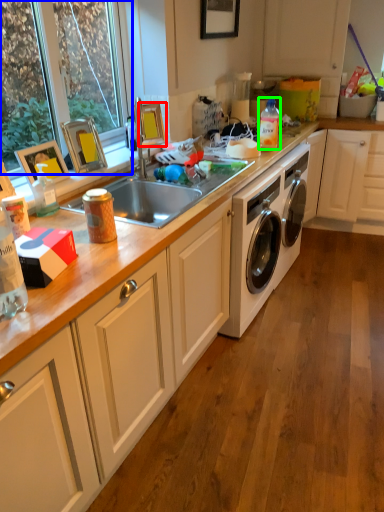
Question: Estimate the real-world distances between objects in this image. Which object is farther from picture frame (highlighted by a red box), window frame (highlighted by a blue box) or bottle (highlighted by a green box)?

Choices:
 (A) window frame
 (B) bottle

Answer: (B)